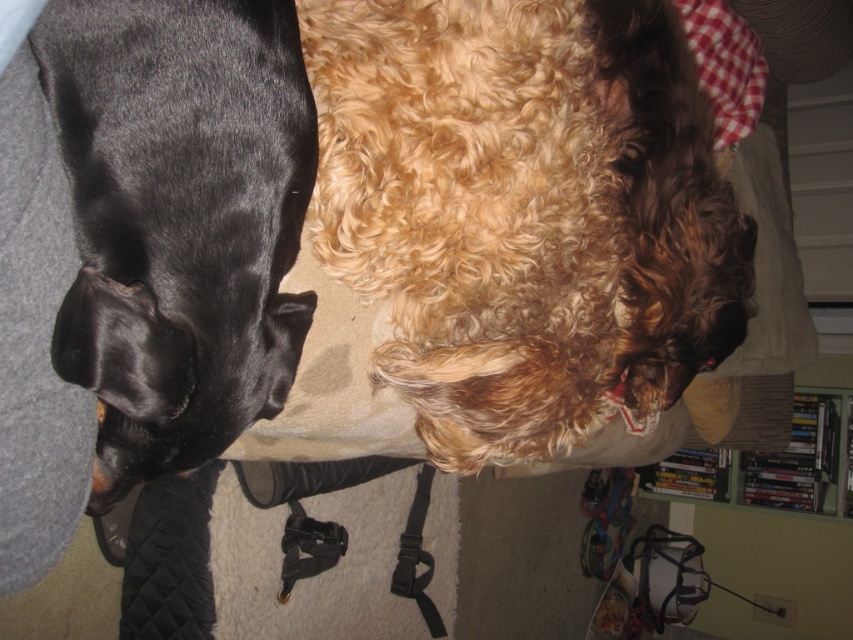
Between point (410, 307) and point (131, 288), which one is positioned in front?

Point (131, 288)

Who is higher up, curly golden fur at upper center or shiny black dog at left?

curly golden fur at upper center is higher up.

Is point (581, 248) closer to viewer compared to point (235, 416)?

No, it is behind (235, 416).

Find the location of a particular element. Image resolution: width=853 pixels, height=640 pixels. curly golden fur at upper center is located at coordinates tap(524, 211).